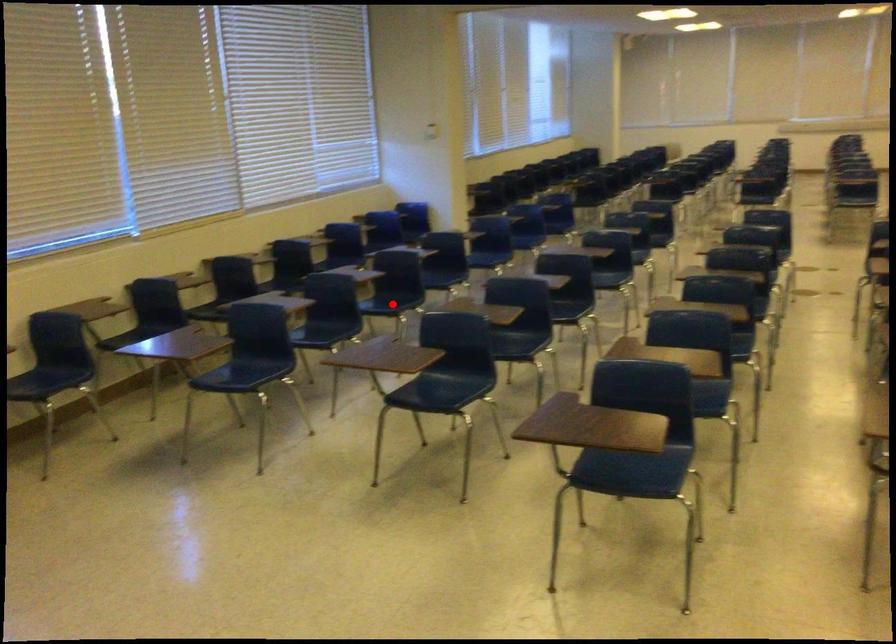
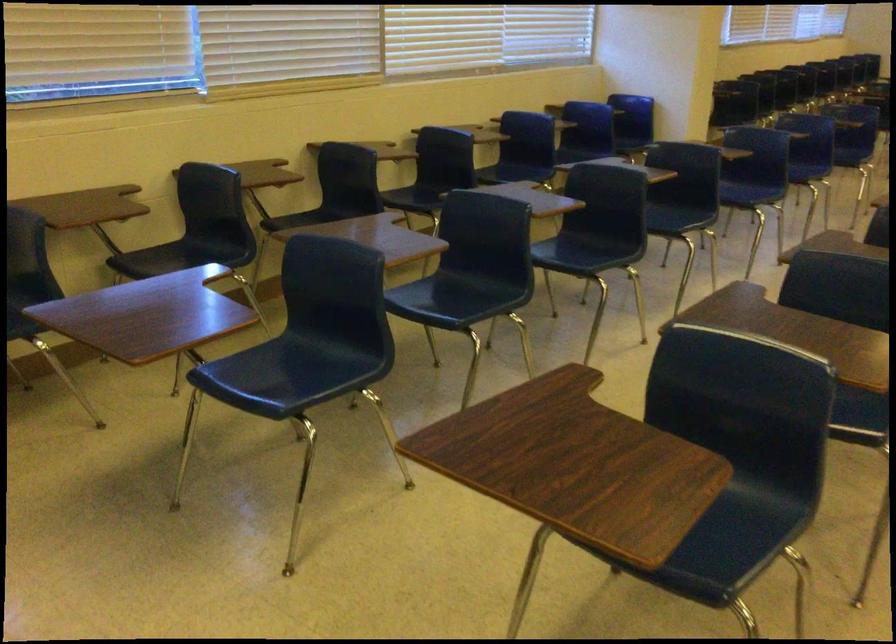
The point at the highlighted location is marked in the first image. Where is the corresponding point in the second image?

(586, 252)